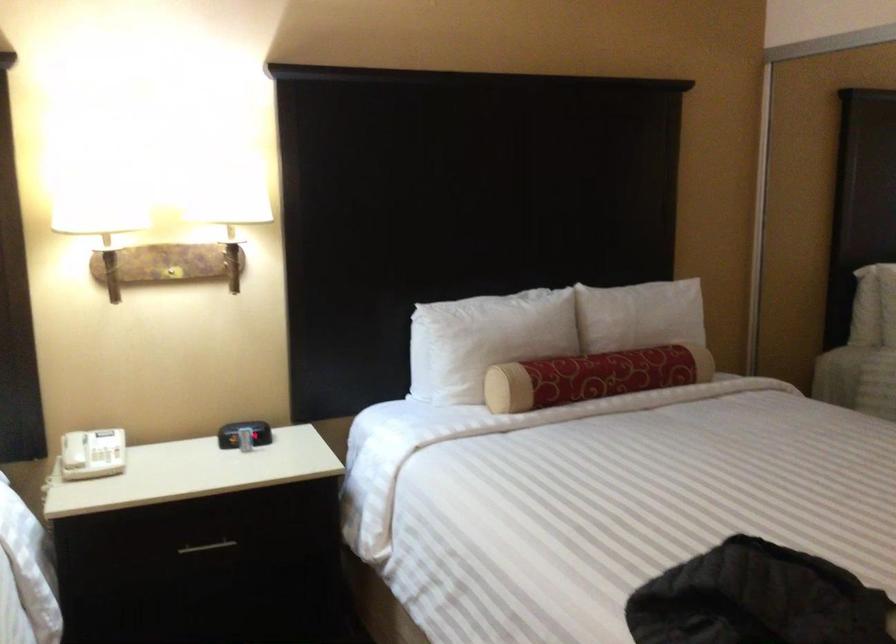
Where is `lamp switch`? This screenshot has width=896, height=644. lamp switch is located at coordinates (171, 272).